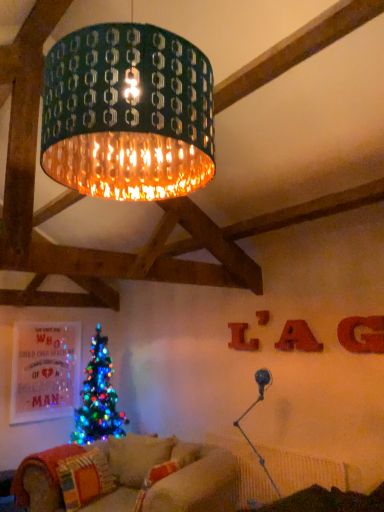
Question: Does matte red letter at upper right, which is the second letter in front-to-back order, appear on the left side of matte red letter at upper right, the 4th letter in the front-to-back sequence?

Choices:
 (A) yes
 (B) no

Answer: (B)

Question: Is the position of matte red letter at upper right, the 3th letter when ordered from left to right, less distant than that of matte red letter at upper right, marked as the 1th letter in a back-to-front arrangement?

Choices:
 (A) no
 (B) yes

Answer: (B)

Question: Would you say matte red letter at upper right, marked as the 2th letter in a right-to-left arrangement, is a long distance from matte red letter at upper right, positioned as the 1th letter in left-to-right order?

Choices:
 (A) yes
 (B) no

Answer: (B)

Question: From the image's perspective, does matte red letter at upper right, the third letter in the back-to-front sequence, appear lower than matte red letter at upper right, marked as the 1th letter in a back-to-front arrangement?

Choices:
 (A) no
 (B) yes

Answer: (A)

Question: Does matte red letter at upper right, the 3th letter when ordered from left to right, have a smaller size compared to matte red letter at upper right, positioned as the 1th letter in left-to-right order?

Choices:
 (A) yes
 (B) no

Answer: (B)

Question: From the image's perspective, is matte red letter at upper right, the third letter in the back-to-front sequence, on top of matte red letter at upper right, the 4th letter in the front-to-back sequence?

Choices:
 (A) no
 (B) yes

Answer: (B)

Question: Is multicolored fabric pillow at lower left, the 1th pillow when ordered from left to right, to the right of metallic silver table lamp at lower right from the viewer's perspective?

Choices:
 (A) no
 (B) yes

Answer: (A)

Question: Is multicolored fabric pillow at lower left, the 1th pillow when ordered from left to right, facing towards metallic silver table lamp at lower right?

Choices:
 (A) no
 (B) yes

Answer: (B)

Question: Is multicolored fabric pillow at lower left, the 1th pillow when ordered from left to right, positioned behind metallic silver table lamp at lower right?

Choices:
 (A) yes
 (B) no

Answer: (A)

Question: Could metallic silver table lamp at lower right be considered to be inside multicolored fabric pillow at lower left, the 1th pillow when ordered from left to right?

Choices:
 (A) no
 (B) yes

Answer: (A)

Question: Can you confirm if multicolored fabric pillow at lower left, which appears as the 2th pillow when viewed from the right, is thinner than metallic silver table lamp at lower right?

Choices:
 (A) yes
 (B) no

Answer: (B)

Question: Would you say multicolored fabric pillow at lower left, which appears as the 2th pillow when viewed from the right, is outside metallic silver table lamp at lower right?

Choices:
 (A) no
 (B) yes

Answer: (B)

Question: Can matte red letter at upper right, positioned as the 1th letter in left-to-right order, be found inside multicolored fabric pillow at lower left, which appears as the 2th pillow when viewed from the right?

Choices:
 (A) yes
 (B) no

Answer: (B)